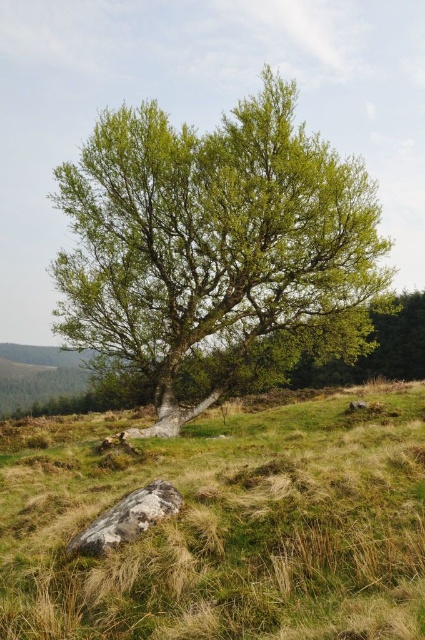
Question: Which point appears farthest from the camera in this image?

Choices:
 (A) (87, 547)
 (B) (206, 323)
 (C) (48, 632)

Answer: (B)

Question: Which object is positioned closest to the green grass at lower center?

Choices:
 (A) green leafy tree at center
 (B) gray rough rock at lower center

Answer: (B)

Question: Does green grass at lower center have a lesser width compared to gray rough rock at lower center?

Choices:
 (A) no
 (B) yes

Answer: (A)

Question: Does green grass at lower center appear under green leafy tree at center?

Choices:
 (A) no
 (B) yes

Answer: (B)

Question: Is green grass at lower center bigger than green leafy tree at center?

Choices:
 (A) no
 (B) yes

Answer: (A)

Question: Which point is farther to the camera?

Choices:
 (A) green grass at lower center
 (B) green leafy tree at center
 (C) gray rough rock at lower center

Answer: (B)